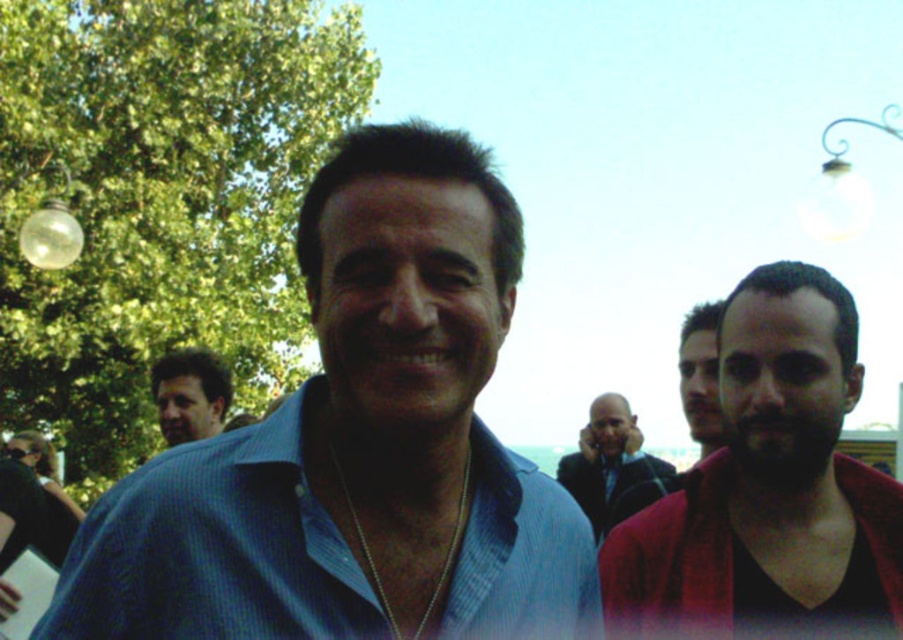
Question: Is blue textured shirt at center smaller than brown leather jacket at left?

Choices:
 (A) yes
 (B) no

Answer: (B)

Question: Considering the real-world distances, which object is closest to the blue textured shirt at center?

Choices:
 (A) smooth red jacket at right
 (B) smooth black shirt at center

Answer: (A)

Question: Which point is closer to the camera taking this photo?

Choices:
 (A) (849, 388)
 (B) (203, 419)

Answer: (A)

Question: Can you confirm if smooth red jacket at right is smaller than smooth brown hair at right?

Choices:
 (A) no
 (B) yes

Answer: (A)

Question: Among these points, which one is nearest to the camera?

Choices:
 (A) (202, 358)
 (B) (594, 417)

Answer: (A)

Question: Can you confirm if brown leather jacket at left is positioned above smooth brown hair at right?

Choices:
 (A) yes
 (B) no

Answer: (B)